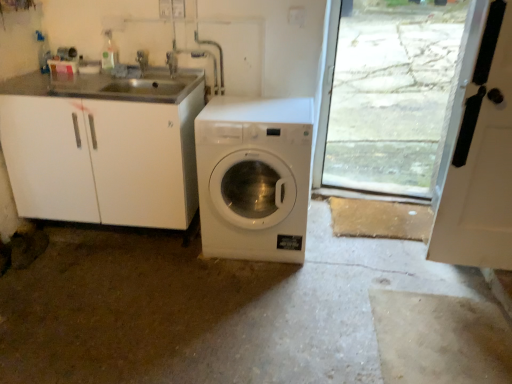
Image resolution: width=512 pixels, height=384 pixels. Describe the element at coordinates (254, 177) in the screenshot. I see `white glossy washing machine at center` at that location.

Locate an element on the screen. This screenshot has width=512, height=384. white glossy washing machine at center is located at coordinates [254, 177].

The width and height of the screenshot is (512, 384). In order to click on washing machine directly beneath the brushed metal faucet at upper center, which is counted as the first faucet, starting from the right (from a real-world perspective) in this screenshot , I will do `click(254, 177)`.

From the image's perspective, is brushed metal faucet at upper center, which is counted as the second faucet, starting from the left, positioned above or below white glossy washing machine at center?

Clearly, from the image's perspective, brushed metal faucet at upper center, which is counted as the second faucet, starting from the left, is above white glossy washing machine at center.

Considering the relative positions of brushed metal faucet at upper center, which is counted as the first faucet, starting from the right, and white glossy washing machine at center in the image provided, is brushed metal faucet at upper center, which is counted as the first faucet, starting from the right, behind white glossy washing machine at center?

Yes, brushed metal faucet at upper center, which is counted as the first faucet, starting from the right, is behind white glossy washing machine at center.

Looking at this image, from a real-world perspective, who is located higher, brushed metal faucet at upper center, which is counted as the first faucet, starting from the right, or white glossy washing machine at center?

In real-world perspective, brushed metal faucet at upper center, which is counted as the first faucet, starting from the right, is above.

How different are the orientations of white matte door at right and brushed metal faucet at upper center, the second faucet in the right-to-left sequence, in degrees?

0.849 degrees.

Which object is wider, white matte door at right or brushed metal faucet at upper center, the first faucet from the left?

With larger width is white matte door at right.

From the image's perspective, which object appears higher, white matte door at right or brushed metal faucet at upper center, the first faucet from the left?

brushed metal faucet at upper center, the first faucet from the left, from the image's perspective.

From a real-world perspective, does white matte door at right stand above brushed metal faucet at upper center, the second faucet in the right-to-left sequence?

No, from a real-world perspective, white matte door at right is not over brushed metal faucet at upper center, the second faucet in the right-to-left sequence

Considering the points (279, 125) and (137, 53), which point is in front, point (279, 125) or point (137, 53)?

Positioned in front is point (279, 125).

From the image's perspective, is white glossy washing machine at center positioned above or below brushed metal faucet at upper center, the first faucet from the left?

Clearly, from the image's perspective, white glossy washing machine at center is below brushed metal faucet at upper center, the first faucet from the left.

From a real-world perspective, is white glossy washing machine at center physically located above or below brushed metal faucet at upper center, the first faucet from the left?

From a real-world perspective, white glossy washing machine at center is physically below brushed metal faucet at upper center, the first faucet from the left.

In the scene shown: Which of these two, white glossy washing machine at center or brushed metal faucet at upper center, the first faucet from the left, is thinner?

brushed metal faucet at upper center, the first faucet from the left.

Consider the image. In terms of height, does brushed metal faucet at upper center, which is counted as the second faucet, starting from the left, look taller or shorter compared to white matte door at right?

Clearly, brushed metal faucet at upper center, which is counted as the second faucet, starting from the left, is shorter compared to white matte door at right.

Looking at this image, is brushed metal faucet at upper center, which is counted as the second faucet, starting from the left, situated inside white matte door at right or outside?

brushed metal faucet at upper center, which is counted as the second faucet, starting from the left, is not enclosed by white matte door at right.

Are brushed metal faucet at upper center, which is counted as the first faucet, starting from the right, and white matte door at right making contact?

brushed metal faucet at upper center, which is counted as the first faucet, starting from the right, is not next to white matte door at right, and they're not touching.

Is point (170, 71) behind point (471, 131)?

Yes, point (170, 71) is behind point (471, 131).

From a real-world perspective, is brushed metal faucet at upper center, which is counted as the second faucet, starting from the left, located higher than brushed metal faucet at upper center, the second faucet in the right-to-left sequence?

Actually, brushed metal faucet at upper center, which is counted as the second faucet, starting from the left, is physically below brushed metal faucet at upper center, the second faucet in the right-to-left sequence, in the real world.

Locate an element on the screen. faucet that is under the brushed metal faucet at upper center, the second faucet in the right-to-left sequence (from a real-world perspective) is located at coordinates (172, 63).

Is brushed metal faucet at upper center, which is counted as the second faucet, starting from the left, at the left side of brushed metal faucet at upper center, the first faucet from the left?

No, brushed metal faucet at upper center, which is counted as the second faucet, starting from the left, is not to the left of brushed metal faucet at upper center, the first faucet from the left.

Between brushed metal faucet at upper center, which is counted as the first faucet, starting from the right, and brushed metal faucet at upper center, the first faucet from the left, which one has smaller size?

With smaller size is brushed metal faucet at upper center, which is counted as the first faucet, starting from the right.

From the image's perspective, which object appears higher, brushed metal faucet at upper center, the second faucet in the right-to-left sequence, or brushed metal faucet at upper center, which is counted as the first faucet, starting from the right?

brushed metal faucet at upper center, the second faucet in the right-to-left sequence, from the image's perspective.

Between brushed metal faucet at upper center, the first faucet from the left, and brushed metal faucet at upper center, which is counted as the second faucet, starting from the left, which one appears on the left side from the viewer's perspective?

brushed metal faucet at upper center, the first faucet from the left, is more to the left.

Between brushed metal faucet at upper center, the second faucet in the right-to-left sequence, and brushed metal faucet at upper center, which is counted as the second faucet, starting from the left, which one has smaller size?

With smaller size is brushed metal faucet at upper center, which is counted as the second faucet, starting from the left.

Which is closer, (143, 63) or (167, 64)?

Point (143, 63) appears to be farther away from the viewer than point (167, 64).

Does point (457, 253) lie in front of point (249, 158)?

Yes, point (457, 253) is closer to viewer.

Would you say white matte door at right is a long distance from white glossy washing machine at center?

Actually, white matte door at right and white glossy washing machine at center are a little close together.

Is white matte door at right at the left side of white glossy washing machine at center?

In fact, white matte door at right is to the right of white glossy washing machine at center.

This screenshot has height=384, width=512. In order to click on washing machine that is below the brushed metal faucet at upper center, which is counted as the first faucet, starting from the right (from the image's perspective) in this screenshot , I will do `click(254, 177)`.

Where is `the 2nd faucet behind the white matte door at right`? the 2nd faucet behind the white matte door at right is located at coordinates (142, 60).

Looking at this image, estimate the real-world distances between objects in this image. Which object is further from white glossy washing machine at center, brushed metal faucet at upper center, the second faucet in the right-to-left sequence, or white matte door at right?

brushed metal faucet at upper center, the second faucet in the right-to-left sequence, lies further to white glossy washing machine at center than the other object.

Looking at the image, which one is located further to white matte door at right, white glossy washing machine at center or brushed metal faucet at upper center, the second faucet in the right-to-left sequence?

A: Based on the image, brushed metal faucet at upper center, the second faucet in the right-to-left sequence, appears to be further to white matte door at right.

Looking at the image, which one is located closer to brushed metal faucet at upper center, which is counted as the first faucet, starting from the right, white matte door at right or white glossy washing machine at center?

The object closer to brushed metal faucet at upper center, which is counted as the first faucet, starting from the right, is white glossy washing machine at center.

When comparing their distances from white glossy washing machine at center, does brushed metal faucet at upper center, which is counted as the first faucet, starting from the right, or brushed metal faucet at upper center, the second faucet in the right-to-left sequence, seem closer?

Among the two, brushed metal faucet at upper center, which is counted as the first faucet, starting from the right, is located nearer to white glossy washing machine at center.

Looking at the image, which one is located further to brushed metal faucet at upper center, which is counted as the second faucet, starting from the left, white glossy washing machine at center or brushed metal faucet at upper center, the second faucet in the right-to-left sequence?

white glossy washing machine at center is positioned further to the anchor brushed metal faucet at upper center, which is counted as the second faucet, starting from the left.

Considering their positions, is brushed metal faucet at upper center, the second faucet in the right-to-left sequence, positioned further to brushed metal faucet at upper center, which is counted as the first faucet, starting from the right, than white glossy washing machine at center?

Among the two, white glossy washing machine at center is located further to brushed metal faucet at upper center, which is counted as the first faucet, starting from the right.

Looking at the image, which one is located further to white matte door at right, brushed metal faucet at upper center, which is counted as the first faucet, starting from the right, or white glossy washing machine at center?

brushed metal faucet at upper center, which is counted as the first faucet, starting from the right, is further to white matte door at right.

When comparing their distances from brushed metal faucet at upper center, which is counted as the second faucet, starting from the left, does white glossy washing machine at center or white matte door at right seem further?

The object further to brushed metal faucet at upper center, which is counted as the second faucet, starting from the left, is white matte door at right.

Where is `washing machine between brushed metal faucet at upper center, which is counted as the second faucet, starting from the left, and white matte door at right`? The width and height of the screenshot is (512, 384). washing machine between brushed metal faucet at upper center, which is counted as the second faucet, starting from the left, and white matte door at right is located at coordinates (254, 177).

Where is `faucet between brushed metal faucet at upper center, the first faucet from the left, and white matte door at right from left to right`? This screenshot has width=512, height=384. faucet between brushed metal faucet at upper center, the first faucet from the left, and white matte door at right from left to right is located at coordinates (172, 63).

Find the location of `faucet between brushed metal faucet at upper center, the second faucet in the right-to-left sequence, and white glossy washing machine at center vertically`. faucet between brushed metal faucet at upper center, the second faucet in the right-to-left sequence, and white glossy washing machine at center vertically is located at coordinates (x=172, y=63).

The image size is (512, 384). Identify the location of washing machine between brushed metal faucet at upper center, the second faucet in the right-to-left sequence, and white matte door at right. (254, 177).